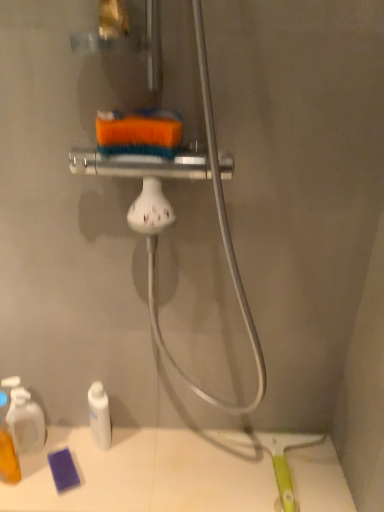
The height and width of the screenshot is (512, 384). Identify the location of vacant space that is to the left of white matte bottle at lower left, the 1th toiletry positioned from the right. (55, 449).